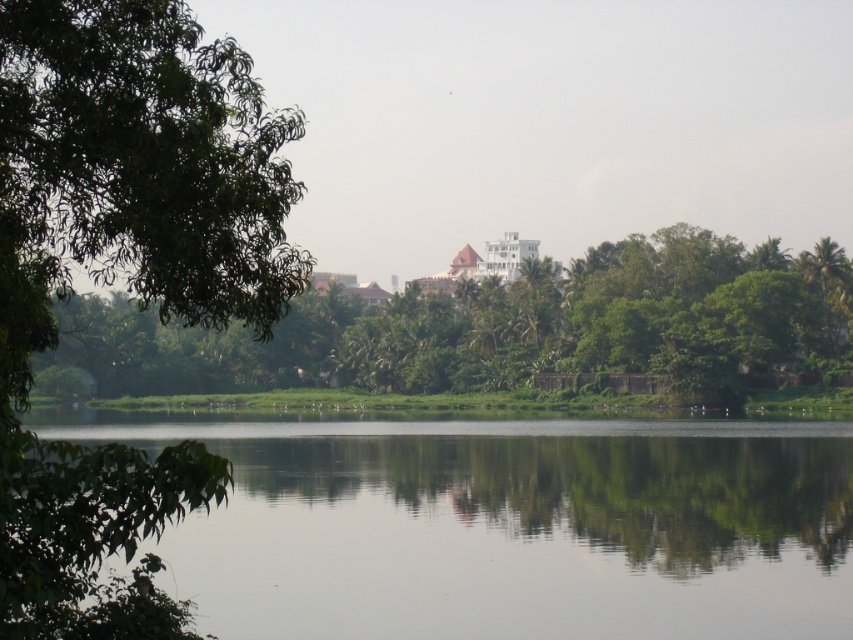
You are a photographer planning to capture the white glossy palace at center and the green leafy tree at left in a single shot. Based on their positions, which object should you focus on first to ensure both are in frame?

The green leafy tree at left is located below the white glossy palace at center, so you should focus on the white glossy palace at center first to ensure both are in frame.

You are standing at point (503, 326) in the image. What object is located exactly at this coordinate?

At point (503, 326) lies green leafy tree at center.

You are planning to take a photo of the white glossy palace at center from the left side of the green leafy tree at left. Will the tree block the view of the palace?

The green leafy tree at left is smaller in size compared to white glossy palace at center. Therefore, the tree may not fully block the view of the palace, but could partially obscure it depending on the angle and distance.